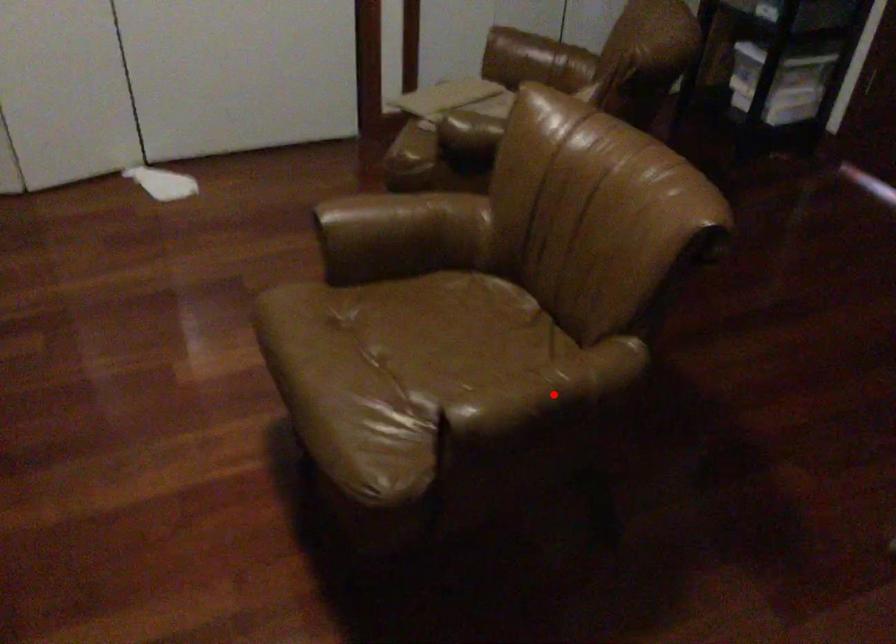
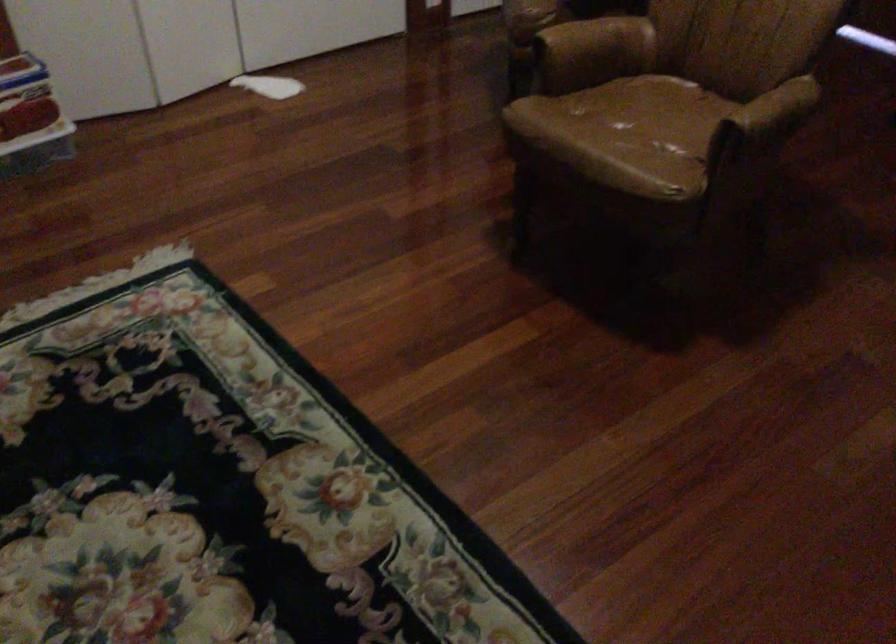
Locate, in the second image, the point that corresponds to the highlighted location in the first image.

(776, 109)